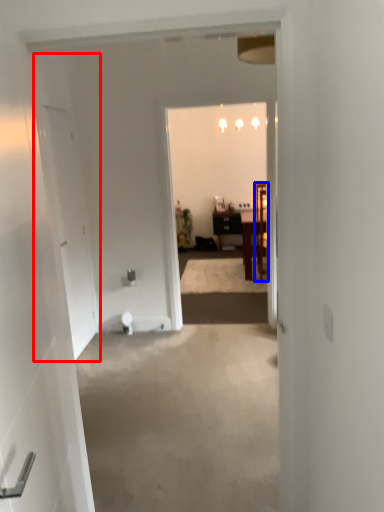
Question: Which point is closer to the camera, door (highlighted by a red box) or chair (highlighted by a blue box)?

Choices:
 (A) door
 (B) chair

Answer: (A)